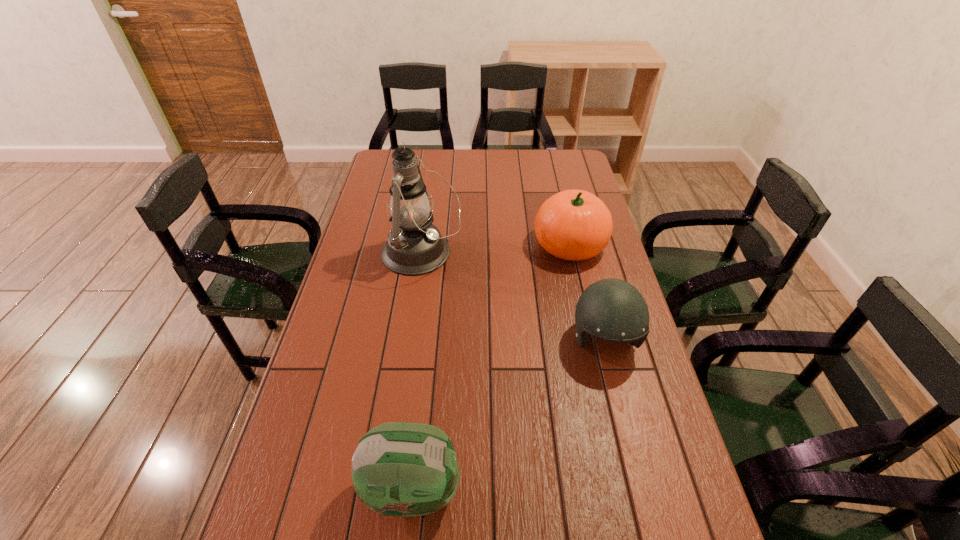
Identify the location of free spot between the pumpkin and the oil lamp. The image size is (960, 540). (495, 249).

Find the location of a particular element. vacant space in between the nearest object and the pumpkin is located at coordinates (492, 367).

Find the location of a particular element. This screenshot has width=960, height=540. free space that is in between the pumpkin and the tallest object is located at coordinates [x=495, y=249].

Identify the location of object that is the closest to the oil lamp. The height and width of the screenshot is (540, 960). (573, 224).

Identify the location of the second closest object relative to the tallest object. (613, 310).

At what (x,y) coordinates should I click in order to perform the action: click on vacant space that satisfies the following two spatial constraints: 1. at the face opening of the third farthest object; 2. on the visor of the left football helmet. Please return your answer as a coordinate pair (x, y). The image size is (960, 540). Looking at the image, I should click on (642, 489).

This screenshot has width=960, height=540. What are the coordinates of `vacant point that satisfies the following two spatial constraints: 1. at the face opening of the third farthest object; 2. on the visor of the nearer football helmet` in the screenshot? It's located at (642, 489).

This screenshot has height=540, width=960. In order to click on free point that satisfies the following two spatial constraints: 1. on the front side of the pumpkin; 2. on the visor of the nearest object in this screenshot , I will do `click(625, 489)`.